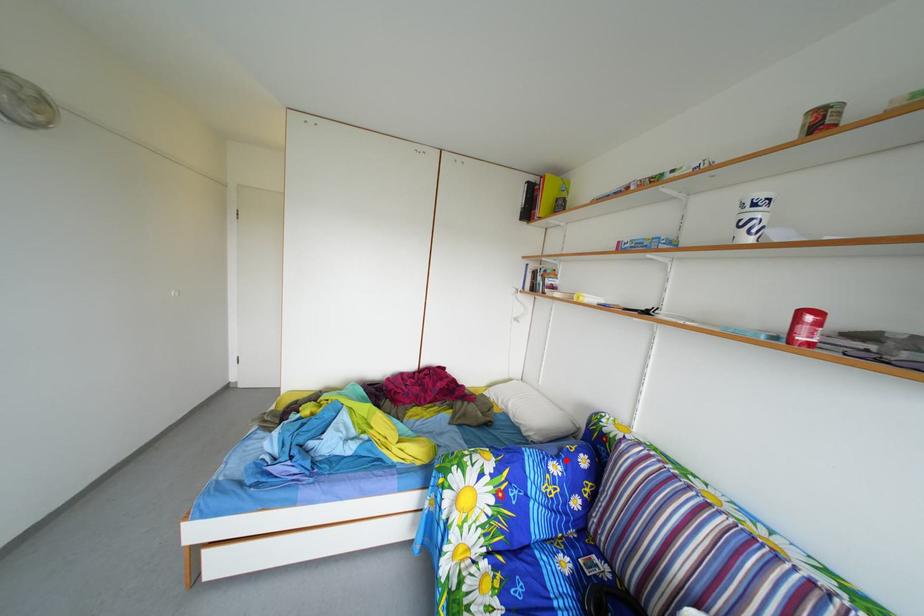
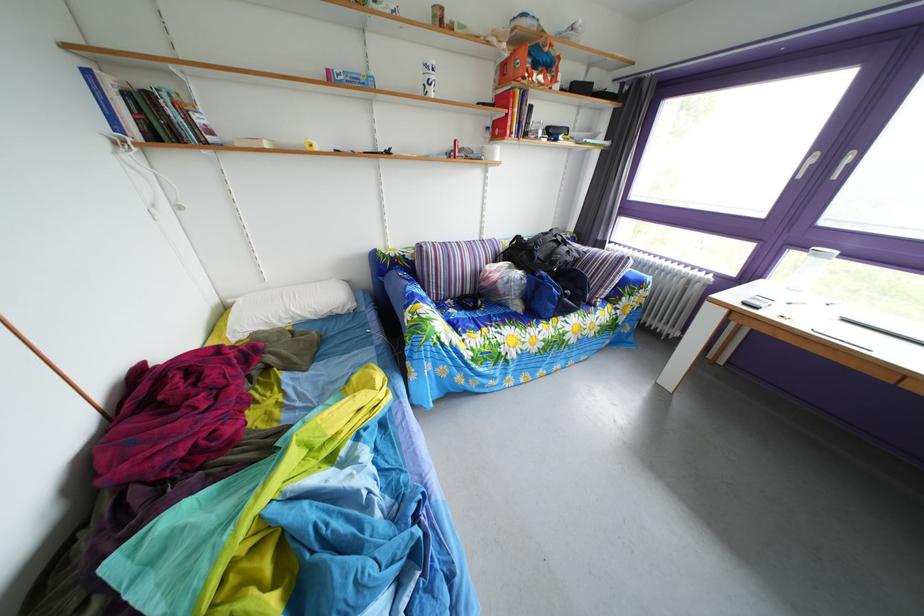
Where in the second image is the point corresponding to the highlighted location from the first image?

(417, 290)